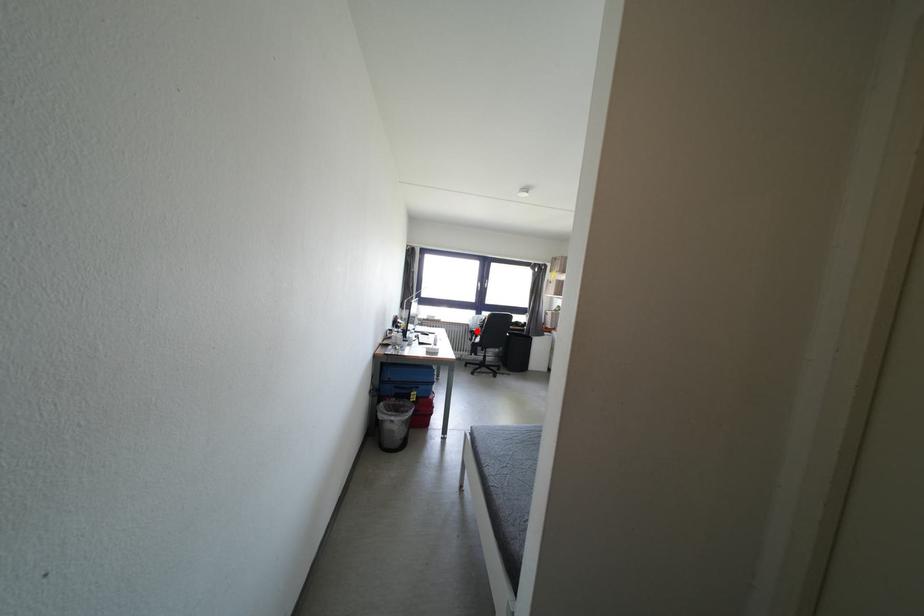
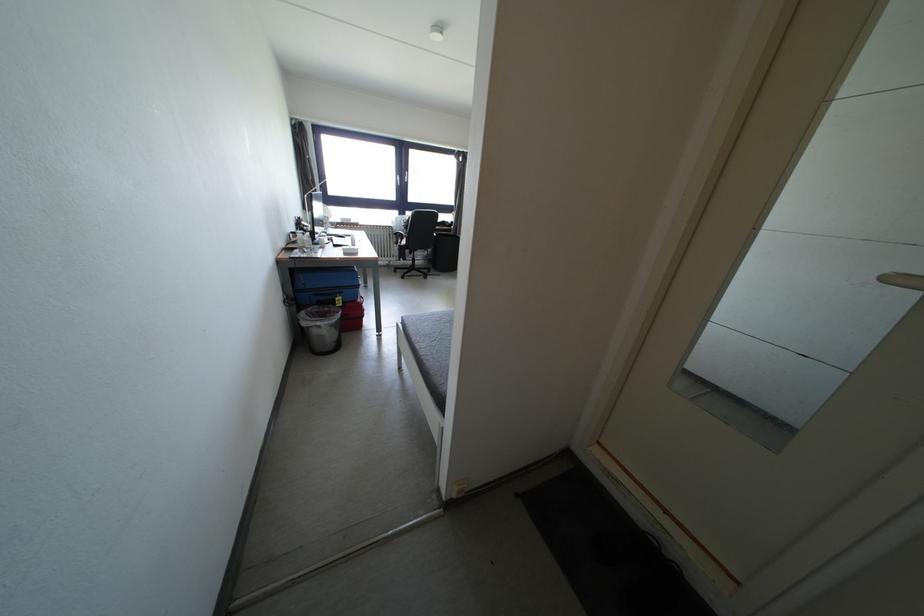
Find the pixel in the second image that matches the highlighted location in the first image.

(400, 233)